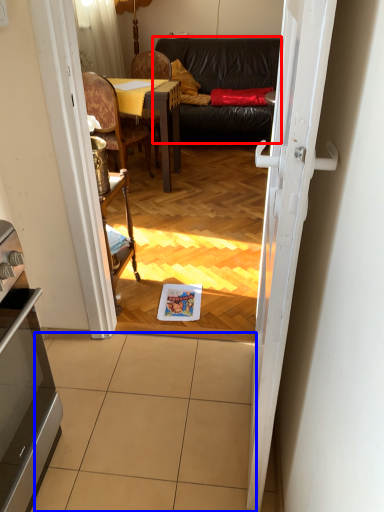
Question: Among these objects, which one is farthest to the camera, studio couch (highlighted by a red box) or tile (highlighted by a blue box)?

Choices:
 (A) studio couch
 (B) tile

Answer: (A)